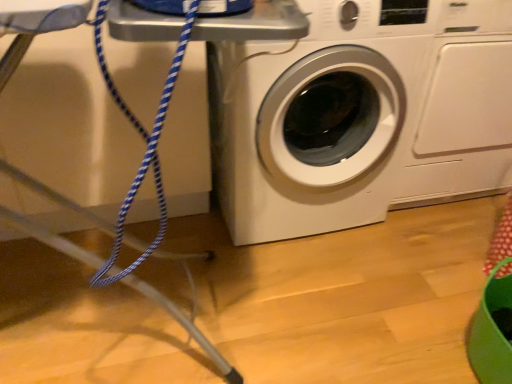
At what (x,y) coordinates should I click in order to perform the action: click on white glossy washing machine at center, the first washing machine from the right. Please return your answer as a coordinate pair (x, y). Looking at the image, I should click on (463, 107).

How much space does white glossy washing machine at center, the first washing machine from the right, occupy horizontally?

It is 78.93 centimeters.

What do you see at coordinates (463, 107) in the screenshot? This screenshot has height=384, width=512. I see `white glossy washing machine at center, the 2th washing machine positioned from the left` at bounding box center [463, 107].

Measure the distance between point (x=260, y=124) and camera.

Point (x=260, y=124) and camera are 4.00 feet apart.

The image size is (512, 384). What are the coordinates of `white glossy washing machine at center, placed as the 2th washing machine when sorted from right to left` in the screenshot? It's located at (315, 118).

This screenshot has width=512, height=384. What do you see at coordinates (315, 118) in the screenshot?
I see `white glossy washing machine at center, placed as the 2th washing machine when sorted from right to left` at bounding box center [315, 118].

This screenshot has width=512, height=384. I want to click on white glossy washing machine at center, the 2th washing machine positioned from the left, so click(463, 107).

Does white glossy washing machine at center, placed as the 2th washing machine when sorted from right to left, appear on the right side of white glossy washing machine at center, the 2th washing machine positioned from the left?

No.

Is white glossy washing machine at center, placed as the 2th washing machine when sorted from right to left, in front of or behind white glossy washing machine at center, the 2th washing machine positioned from the left, in the image?

white glossy washing machine at center, placed as the 2th washing machine when sorted from right to left, is positioned closer to the viewer than white glossy washing machine at center, the 2th washing machine positioned from the left.

Between point (268, 96) and point (432, 100), which one is positioned behind?

Positioned behind is point (432, 100).

From the image's perspective, is white glossy washing machine at center, placed as the 2th washing machine when sorted from right to left, beneath white glossy washing machine at center, the 2th washing machine positioned from the left?

Correct, white glossy washing machine at center, placed as the 2th washing machine when sorted from right to left, appears lower than white glossy washing machine at center, the 2th washing machine positioned from the left, in the image.

From a real-world perspective, which object rests below the other?

From a 3D spatial view, white glossy washing machine at center, the first washing machine from the right, is below.

Considering the sizes of white glossy washing machine at center, which is the 1th washing machine in left-to-right order, and white glossy washing machine at center, the first washing machine from the right, in the image, is white glossy washing machine at center, which is the 1th washing machine in left-to-right order, wider or thinner than white glossy washing machine at center, the first washing machine from the right,?

white glossy washing machine at center, which is the 1th washing machine in left-to-right order, is wider than white glossy washing machine at center, the first washing machine from the right.

Which of these two, white glossy washing machine at center, placed as the 2th washing machine when sorted from right to left, or white glossy washing machine at center, the 2th washing machine positioned from the left, stands taller?

Standing taller between the two is white glossy washing machine at center, placed as the 2th washing machine when sorted from right to left.

Who is smaller, white glossy washing machine at center, which is the 1th washing machine in left-to-right order, or white glossy washing machine at center, the 2th washing machine positioned from the left?

Smaller between the two is white glossy washing machine at center, the 2th washing machine positioned from the left.

Do you think white glossy washing machine at center, placed as the 2th washing machine when sorted from right to left, is within white glossy washing machine at center, the first washing machine from the right, or outside of it?

white glossy washing machine at center, placed as the 2th washing machine when sorted from right to left, cannot be found inside white glossy washing machine at center, the first washing machine from the right.

Is white glossy washing machine at center, placed as the 2th washing machine when sorted from right to left, not close to white glossy washing machine at center, the 2th washing machine positioned from the left?

white glossy washing machine at center, placed as the 2th washing machine when sorted from right to left, is actually quite close to white glossy washing machine at center, the 2th washing machine positioned from the left.

Could you tell me if white glossy washing machine at center, placed as the 2th washing machine when sorted from right to left, is facing white glossy washing machine at center, the 2th washing machine positioned from the left?

No, white glossy washing machine at center, placed as the 2th washing machine when sorted from right to left, is not facing towards white glossy washing machine at center, the 2th washing machine positioned from the left.

Can you tell me how much white glossy washing machine at center, which is the 1th washing machine in left-to-right order, and white glossy washing machine at center, the 2th washing machine positioned from the left, differ in facing direction?

1.42 degrees separate the facing orientations of white glossy washing machine at center, which is the 1th washing machine in left-to-right order, and white glossy washing machine at center, the 2th washing machine positioned from the left.

You are a GUI agent. You are given a task and a screenshot of the screen. Output one action in this format:
    pyautogui.click(x=<x>, y=<y>)
    Task: Click on the washing machine that appears above the white glossy washing machine at center, which is the 1th washing machine in left-to-right order (from the image's perspective)
    This screenshot has height=384, width=512.
    Given the screenshot: What is the action you would take?
    pyautogui.click(x=463, y=107)

Which is more to the left, white glossy washing machine at center, the 2th washing machine positioned from the left, or white glossy washing machine at center, placed as the 2th washing machine when sorted from right to left?

Positioned to the left is white glossy washing machine at center, placed as the 2th washing machine when sorted from right to left.

Is white glossy washing machine at center, the 2th washing machine positioned from the left, positioned behind white glossy washing machine at center, which is the 1th washing machine in left-to-right order?

Yes, white glossy washing machine at center, the 2th washing machine positioned from the left, is further from the camera.

Considering the points (503, 159) and (319, 154), which point is in front, point (503, 159) or point (319, 154)?

Positioned in front is point (319, 154).

From the image's perspective, would you say white glossy washing machine at center, the first washing machine from the right, is shown under white glossy washing machine at center, which is the 1th washing machine in left-to-right order?

Incorrect, from the image's perspective, white glossy washing machine at center, the first washing machine from the right, is higher than white glossy washing machine at center, which is the 1th washing machine in left-to-right order.

Based on the photo, from a real-world perspective, is white glossy washing machine at center, the 2th washing machine positioned from the left, above or below white glossy washing machine at center, placed as the 2th washing machine when sorted from right to left?

white glossy washing machine at center, the 2th washing machine positioned from the left, is situated lower than white glossy washing machine at center, placed as the 2th washing machine when sorted from right to left, in the real world.

Does white glossy washing machine at center, the 2th washing machine positioned from the left, have a greater width compared to white glossy washing machine at center, placed as the 2th washing machine when sorted from right to left?

No, white glossy washing machine at center, the 2th washing machine positioned from the left, is not wider than white glossy washing machine at center, placed as the 2th washing machine when sorted from right to left.

Can you confirm if white glossy washing machine at center, the first washing machine from the right, is shorter than white glossy washing machine at center, placed as the 2th washing machine when sorted from right to left?

Yes.

Between white glossy washing machine at center, the 2th washing machine positioned from the left, and white glossy washing machine at center, which is the 1th washing machine in left-to-right order, which one has larger size?

white glossy washing machine at center, which is the 1th washing machine in left-to-right order, is bigger.

Does white glossy washing machine at center, the 2th washing machine positioned from the left, contain white glossy washing machine at center, placed as the 2th washing machine when sorted from right to left?

That's incorrect, white glossy washing machine at center, placed as the 2th washing machine when sorted from right to left, is not inside white glossy washing machine at center, the 2th washing machine positioned from the left.

Is white glossy washing machine at center, the 2th washing machine positioned from the left, next to white glossy washing machine at center, which is the 1th washing machine in left-to-right order?

white glossy washing machine at center, the 2th washing machine positioned from the left, is not next to white glossy washing machine at center, which is the 1th washing machine in left-to-right order, and they're not touching.

Does white glossy washing machine at center, the first washing machine from the right, turn towards white glossy washing machine at center, placed as the 2th washing machine when sorted from right to left?

No, white glossy washing machine at center, the first washing machine from the right, does not turn towards white glossy washing machine at center, placed as the 2th washing machine when sorted from right to left.

Locate an element on the screen. The width and height of the screenshot is (512, 384). washing machine on the right of white glossy washing machine at center, which is the 1th washing machine in left-to-right order is located at coordinates (463, 107).

This screenshot has height=384, width=512. What are the coordinates of `washing machine that is above the white glossy washing machine at center, which is the 1th washing machine in left-to-right order (from the image's perspective)` in the screenshot? It's located at (463, 107).

Image resolution: width=512 pixels, height=384 pixels. Find the location of `washing machine that is on the left side of white glossy washing machine at center, the 2th washing machine positioned from the left`. washing machine that is on the left side of white glossy washing machine at center, the 2th washing machine positioned from the left is located at coordinates (315, 118).